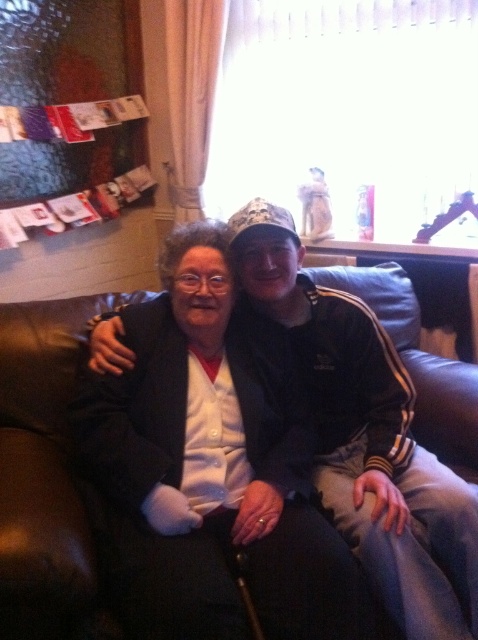
Consider the image. Which is more to the left, black adidas tracksuit at center or brown leather couch at center?

From the viewer's perspective, brown leather couch at center appears more on the left side.

Does black adidas tracksuit at center have a lesser width compared to brown leather couch at center?

In fact, black adidas tracksuit at center might be wider than brown leather couch at center.

Where is `black adidas tracksuit at center`? The height and width of the screenshot is (640, 478). black adidas tracksuit at center is located at coordinates (367, 436).